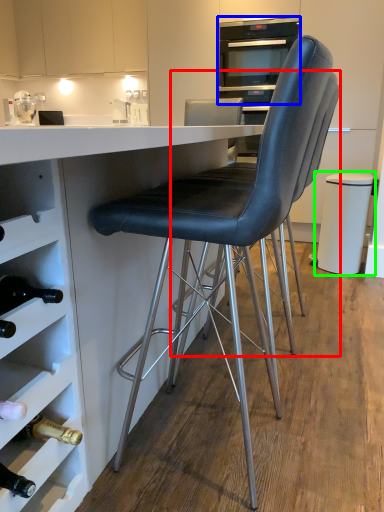
Question: Estimate the real-world distances between objects in this image. Which object is closer to chair (highlighted by a red box), home appliance (highlighted by a blue box) or bar stool (highlighted by a green box)?

Choices:
 (A) home appliance
 (B) bar stool

Answer: (B)